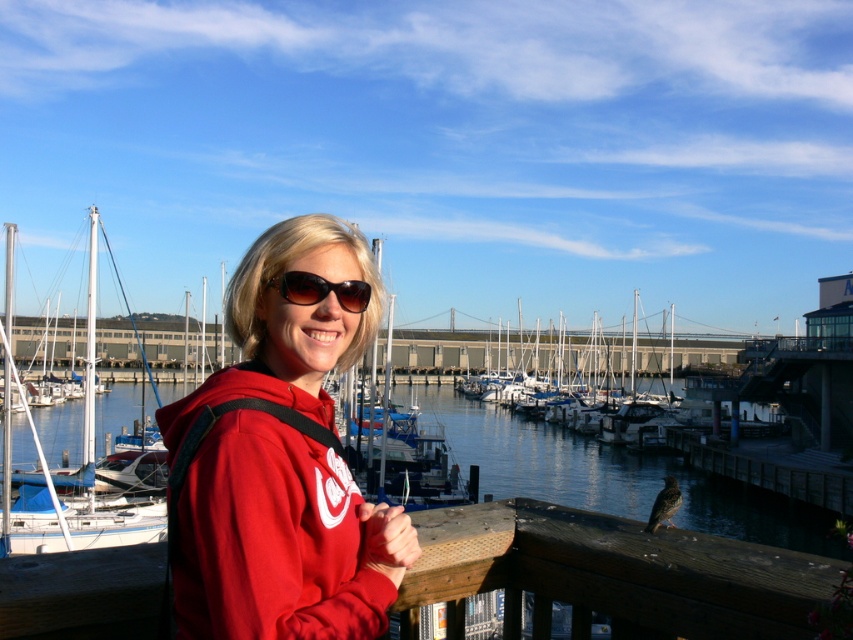
Which is in front, point (583, 413) or point (395, 417)?

Point (395, 417)

Which is above, white glossy boats at center or matte blue sailboat at center?

Positioned higher is white glossy boats at center.

What do you see at coordinates (604, 394) in the screenshot? I see `white glossy boats at center` at bounding box center [604, 394].

Locate an element on the screen. white glossy boats at center is located at coordinates (604, 394).

Between matte blue sailboat at center and sunglasses at center, which one is positioned higher?

sunglasses at center is above.

Image resolution: width=853 pixels, height=640 pixels. I want to click on matte blue sailboat at center, so click(x=409, y=452).

Between point (434, 444) and point (300, 278), which one is positioned in front?

Positioned in front is point (300, 278).

Locate an element on the screen. This screenshot has width=853, height=640. matte blue sailboat at center is located at coordinates (409, 452).

Between point (321, 624) and point (560, 419), which one is positioned behind?

The point (560, 419) is more distant.

The height and width of the screenshot is (640, 853). Identify the location of matte red hoodie at center. (282, 461).